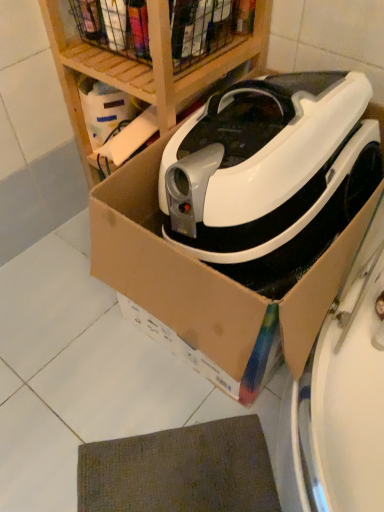
What are the coordinates of `vacant space behind brown textured mat at lower center` in the screenshot? It's located at (144, 377).